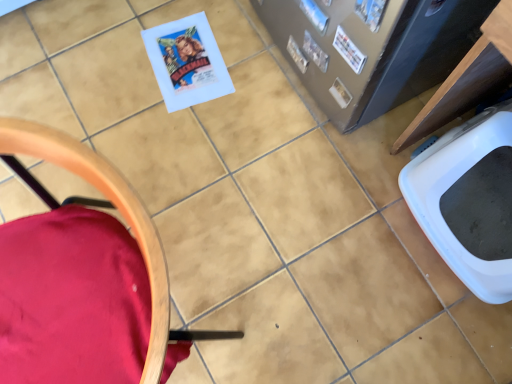
Question: Should I look upward or downward to see velvet red chair at lower left?

Choices:
 (A) up
 (B) down

Answer: (B)

Question: From a real-world perspective, is matte paper comic book at upper right, acting as the 1th comic book starting from the front, positioned over blue glossy comic book at upper right, positioned as the first comic book in back-to-front order, based on gravity?

Choices:
 (A) no
 (B) yes

Answer: (B)

Question: Is matte paper comic book at upper right, the third comic book from the back, at the right side of blue glossy comic book at upper right, the 3th comic book viewed from the front?

Choices:
 (A) no
 (B) yes

Answer: (B)

Question: Is matte paper comic book at upper right, acting as the 1th comic book starting from the front, placed right next to blue glossy comic book at upper right, positioned as the first comic book in back-to-front order?

Choices:
 (A) no
 (B) yes

Answer: (A)

Question: Is matte paper comic book at upper right, the third comic book from the back, positioned beyond the bounds of blue glossy comic book at upper right, the 3th comic book viewed from the front?

Choices:
 (A) no
 (B) yes

Answer: (B)

Question: Is the depth of matte paper comic book at upper right, the third comic book from the back, greater than that of blue glossy comic book at upper right, the 3th comic book viewed from the front?

Choices:
 (A) no
 (B) yes

Answer: (A)

Question: Can you confirm if matte paper comic book at upper right, acting as the 1th comic book starting from the front, is positioned to the left of blue glossy comic book at upper right, positioned as the first comic book in back-to-front order?

Choices:
 (A) yes
 (B) no

Answer: (B)

Question: Is white plastic toilet bowl at lower right smaller than blue glossy comic book at upper right, positioned as the first comic book in back-to-front order?

Choices:
 (A) yes
 (B) no

Answer: (B)

Question: Does white plastic toilet bowl at lower right have a lesser width compared to blue glossy comic book at upper right, the 3th comic book viewed from the front?

Choices:
 (A) no
 (B) yes

Answer: (A)

Question: From the image's perspective, is white plastic toilet bowl at lower right above blue glossy comic book at upper right, positioned as the first comic book in back-to-front order?

Choices:
 (A) no
 (B) yes

Answer: (A)

Question: Is white plastic toilet bowl at lower right at the right side of blue glossy comic book at upper right, the 3th comic book viewed from the front?

Choices:
 (A) yes
 (B) no

Answer: (A)

Question: Is the surface of white plastic toilet bowl at lower right in direct contact with blue glossy comic book at upper right, the 3th comic book viewed from the front?

Choices:
 (A) no
 (B) yes

Answer: (A)

Question: Is white plastic toilet bowl at lower right shorter than blue glossy comic book at upper right, positioned as the first comic book in back-to-front order?

Choices:
 (A) no
 (B) yes

Answer: (A)

Question: Can you confirm if white paper comic book at upper right, which appears as the second comic book when viewed from the front, is thinner than blue glossy comic book at upper right, positioned as the first comic book in back-to-front order?

Choices:
 (A) no
 (B) yes

Answer: (A)